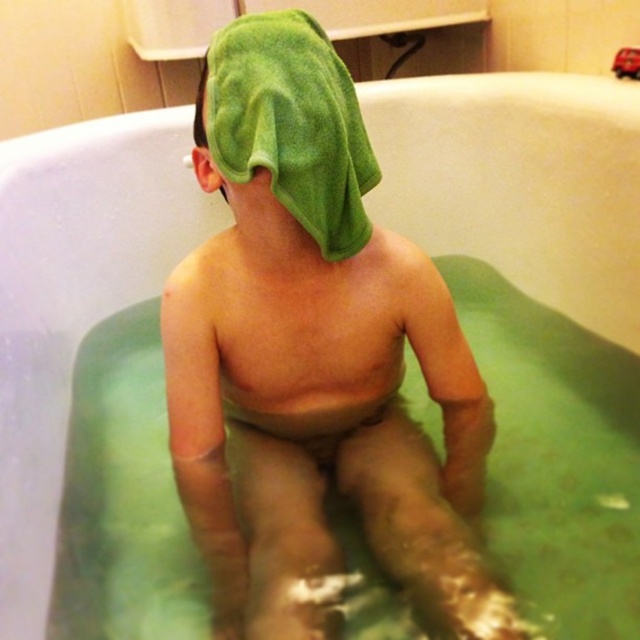
In the scene shown: You are a parent trying to dry your child after a bath. You have two green towels at the back of the tub. The first is labeled as the green towel at back and the second is the green soft towel at back. Which one is closer to you?

The green towel at back is closer to you since it is only 4.47 inches away from the green soft towel at back.

You are a parent trying to dry your child after a bath. You have two towels available in the bathroom. The green towel at back and the green soft towel at back. Which one is taller and thus better for covering the child completely?

The green towel at back is much taller than the green soft towel at back, so it would be better for covering the child completely.

Consider the image. You are a delivery robot that is 20 inches tall. You need to place a package on the point at coordinates point (253,182). Can you reach that point?

The distance of point (253,182) from camera is 30.69 inches. Since the robot is 20 inches tall, it cannot reach the point which is 30.69 inches away.